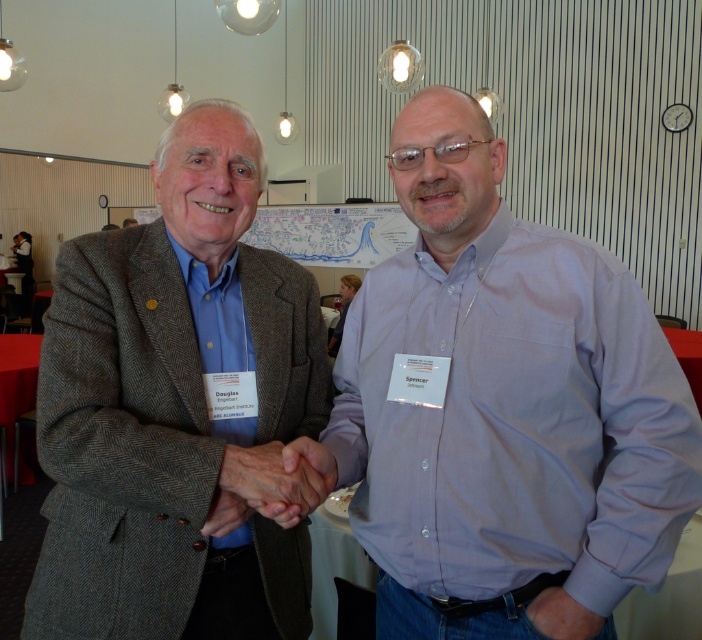
Question: Is white paper map at center smaller than smooth skin handshake at center?

Choices:
 (A) no
 (B) yes

Answer: (A)

Question: Which object is positioned closest to the smooth skin handshake at center?

Choices:
 (A) light blue shirt at center
 (B) gray herringbone blazer at center
 (C) white paper map at center

Answer: (B)

Question: Which point appears farthest from the camera in this image?

Choices:
 (A) (310, 472)
 (B) (364, 218)
 (C) (413, 321)
 (D) (69, 548)

Answer: (B)

Question: Can you confirm if light blue shirt at center is positioned to the left of smooth skin handshake at center?

Choices:
 (A) yes
 (B) no

Answer: (B)

Question: Can you confirm if light blue shirt at center is smaller than white paper map at center?

Choices:
 (A) no
 (B) yes

Answer: (B)

Question: Which object appears closest to the camera in this image?

Choices:
 (A) white paper map at center
 (B) smooth skin handshake at center
 (C) light blue shirt at center

Answer: (C)